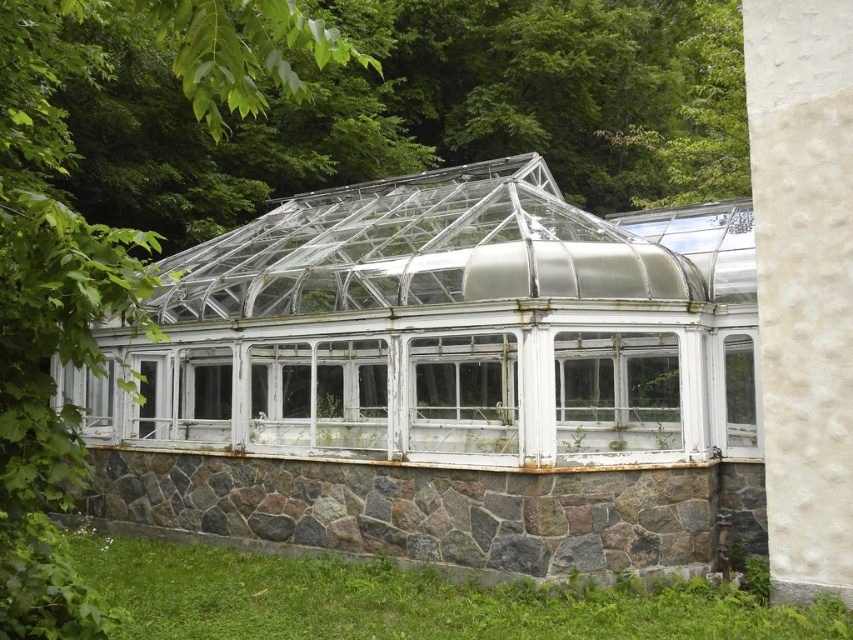
You are standing inside the greenhouse and want to exit through the door located at the lower right corner. You see the green grass at lower left and the white textured glass window at center. Which object is closer to your current position?

The green grass at lower left is closer to your current position because it is located to the left of the white textured glass window at center, which is further away from the door at the lower right corner.

You are standing inside the greenhouse and want to move from the point at coordinates (635,406) to the point at coordinates (251,376). Based on the description, which direction should you move to reach your destination?

You should move backward because point (635,406) is in front of point (251,376), so moving backward will take you towards the latter.

You are a gardener who needs to plant a new flower bed. You have two spots available in the greenhouse scene shown. One is the green grass at lower left and the other is near the transparent glass window at center. Which location would be more suitable for planting based on their heights?

The green grass at lower left has a lesser height compared to the transparent glass window at center, so the green grass at lower left is shorter and would be more suitable for planting the flower bed since it provides a flat surface at ground level.